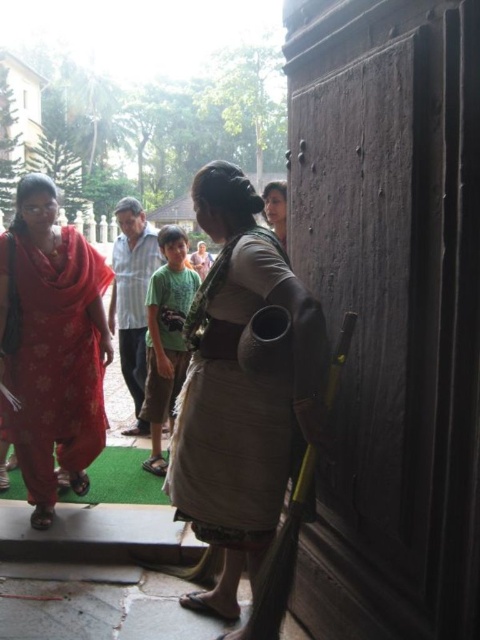
Who is positioned more to the left, dark wood door at right or floral fabric sari at left?

floral fabric sari at left

Is dark wood door at right above floral fabric sari at left?

Yes.

The width and height of the screenshot is (480, 640). Describe the element at coordinates (391, 308) in the screenshot. I see `dark wood door at right` at that location.

Find the location of a particular element. This screenshot has width=480, height=640. dark wood door at right is located at coordinates (391, 308).

Is brown woven cloth at center bigger than floral fabric sari at left?

Indeed, brown woven cloth at center has a larger size compared to floral fabric sari at left.

Looking at this image, who is lower down, brown woven cloth at center or floral fabric sari at left?

brown woven cloth at center

Find the location of a particular element. This screenshot has width=480, height=640. brown woven cloth at center is located at coordinates coord(239,388).

Can you confirm if dark wood door at right is shorter than brown woven cloth at center?

Incorrect, dark wood door at right's height does not fall short of brown woven cloth at center's.

This screenshot has height=640, width=480. In order to click on dark wood door at right in this screenshot , I will do `click(391, 308)`.

Between point (476, 465) and point (233, 580), which one is positioned behind?

The point (233, 580) is more distant.

Locate an element on the screen. The width and height of the screenshot is (480, 640). dark wood door at right is located at coordinates (391, 308).